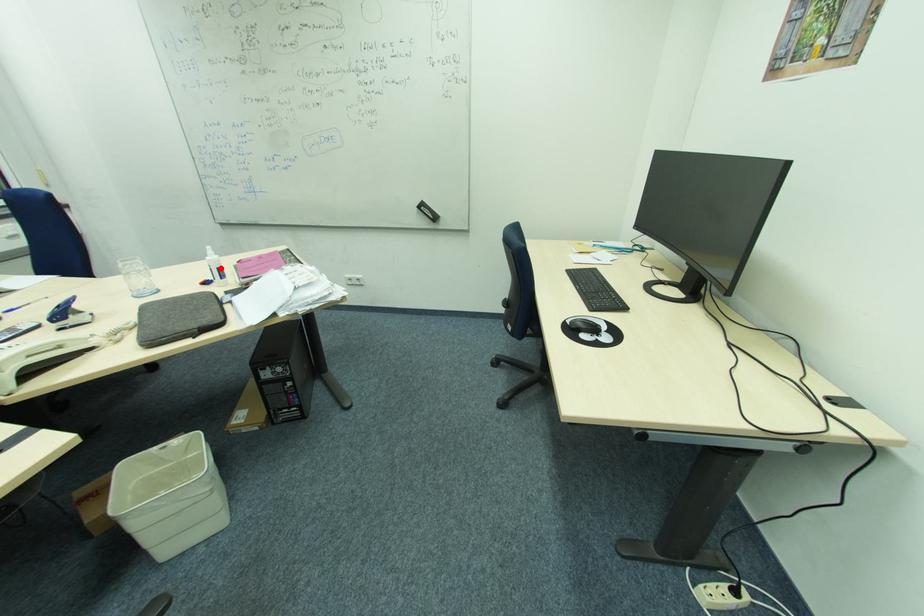
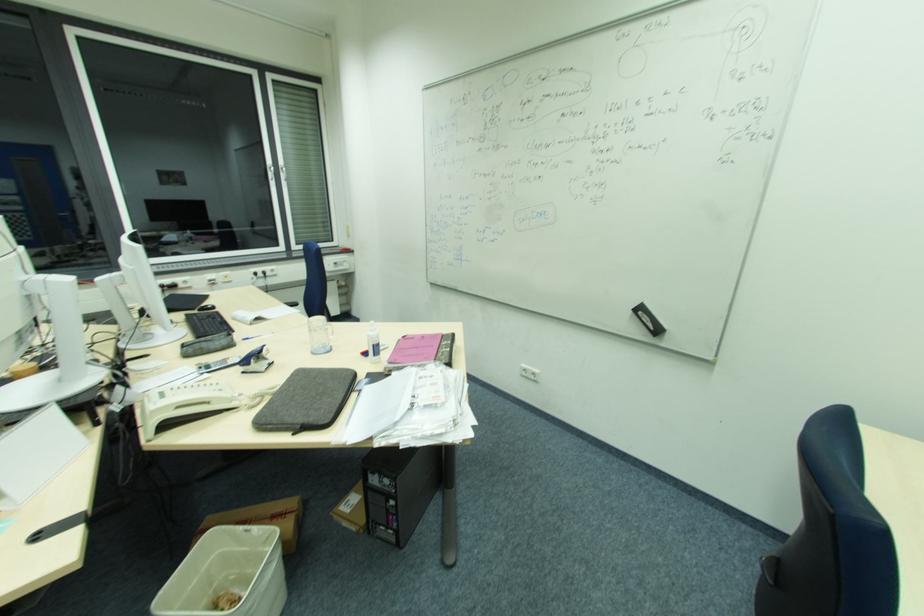
Where in the second image is the point corresponding to the highlighted location from the first image?

(375, 345)